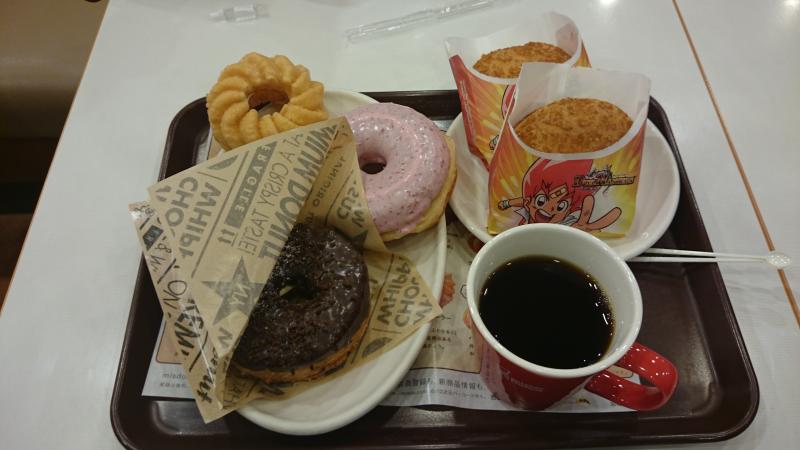
Image resolution: width=800 pixels, height=450 pixels. I want to click on tray liner, so click(442, 360).